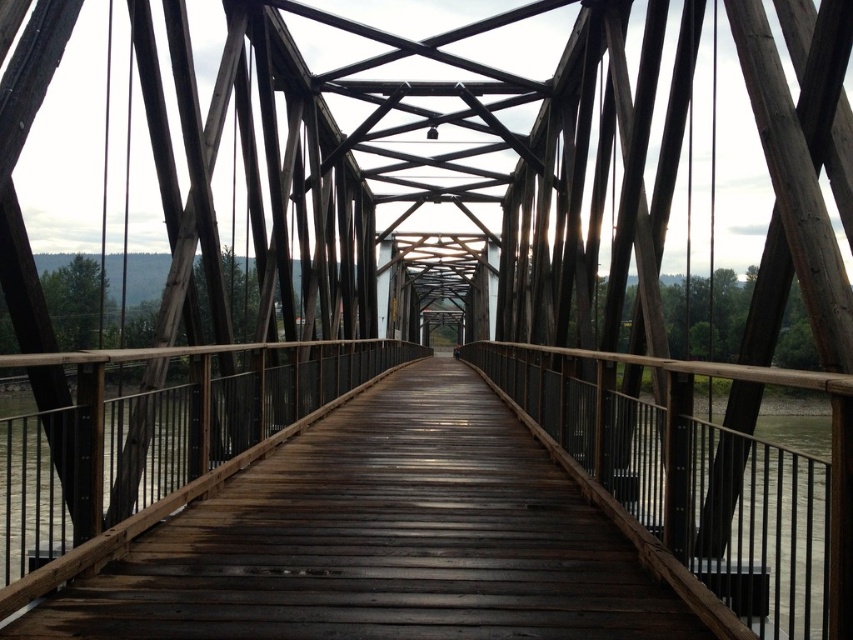
Does brown wooden bridge at center have a lesser width compared to brown/wooden river at lower right?

Indeed, brown wooden bridge at center has a lesser width compared to brown/wooden river at lower right.

Who is higher up, brown wooden bridge at center or brown/wooden river at lower right?

Positioned higher is brown wooden bridge at center.

Is point (625, 513) positioned before point (747, 445)?

That is False.

The height and width of the screenshot is (640, 853). I want to click on brown wooden bridge at center, so click(x=379, y=538).